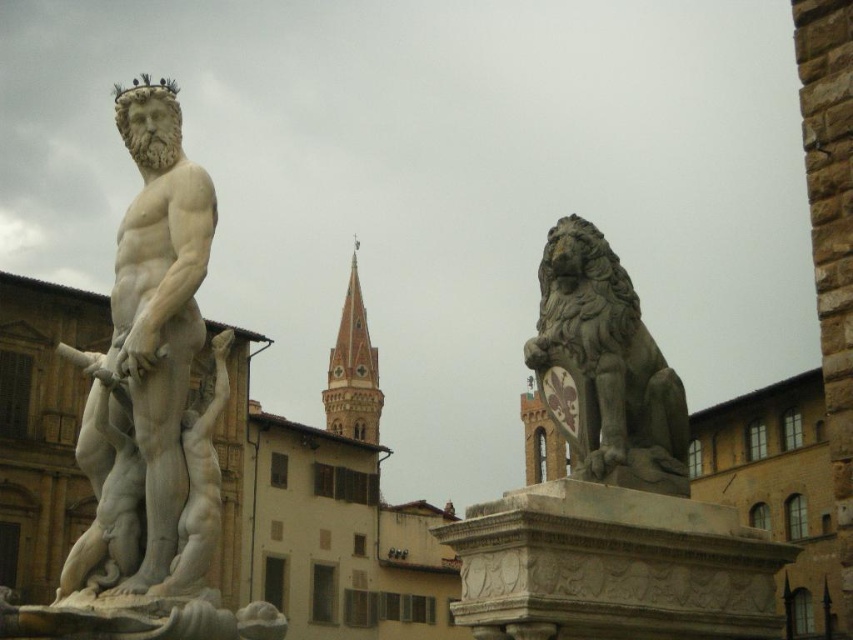
You are an art conservator assessing the placement of the white marble statue at center and the gold metallic crown at upper center. Given their sizes, which object would require a more stable base to prevent tipping over?

The white marble statue at center has a larger size compared to the gold metallic crown at upper center, so it would require a more stable base to prevent tipping over due to its greater mass and height.

You are an art student visiting the square and need to sketch both statues. The white marble statue at center and the polished stone lion at right. Since you have limited time, you want to know which one is taller so you can focus on capturing its proportions first. Can you tell me which statue is taller?

The white marble statue at center is taller than the polished stone lion at right according to the description provided.

You are an art student visiting the square and need to sketch both the white marble statue at center and the polished stone lion at right. Since you have limited time, you want to sketch the smaller one first. Which statue should you choose?

The polished stone lion at right is smaller than the white marble statue at center, so you should sketch the polished stone lion at right first.